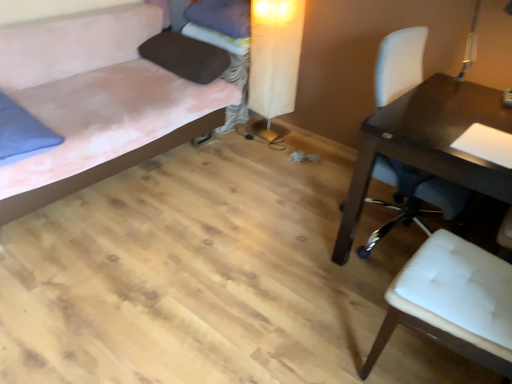
Identify the location of vacant area that lies between beige fabric table lamp at center and white leather chair at right, the first chair from the front. (318, 223).